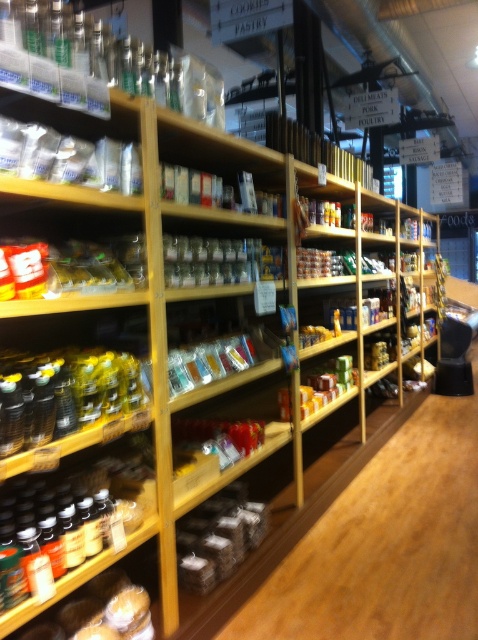
You are a customer in the grocery store and want to place both the translucent plastic bottles at left and the brown matte bagels at lower center into your cart. Since you want to avoid bending too much, which item should you pick up first?

The translucent plastic bottles at left is positioned on the left side of brown matte bagels at lower center, so you should pick up the translucent plastic bottles at left first to minimize bending as they are closer to the edge of the shelf.

Consider the image. You are a grocery store employee who needs to place a new item on a shelf. The new item requires a space that is at least 5 feet away from the camera to ensure visibility. Can the golden brown bread at lower left be placed there?

The golden brown bread at lower left is currently 5.28 feet away from the camera, which meets the requirement of being at least 5 feet away. Therefore, it can be placed there.

You are a customer in the grocery store and see the point marked at coordinates (64, 394). What item is located at this point?

The translucent plastic bottles at left are located at the point marked at coordinates (64, 394).